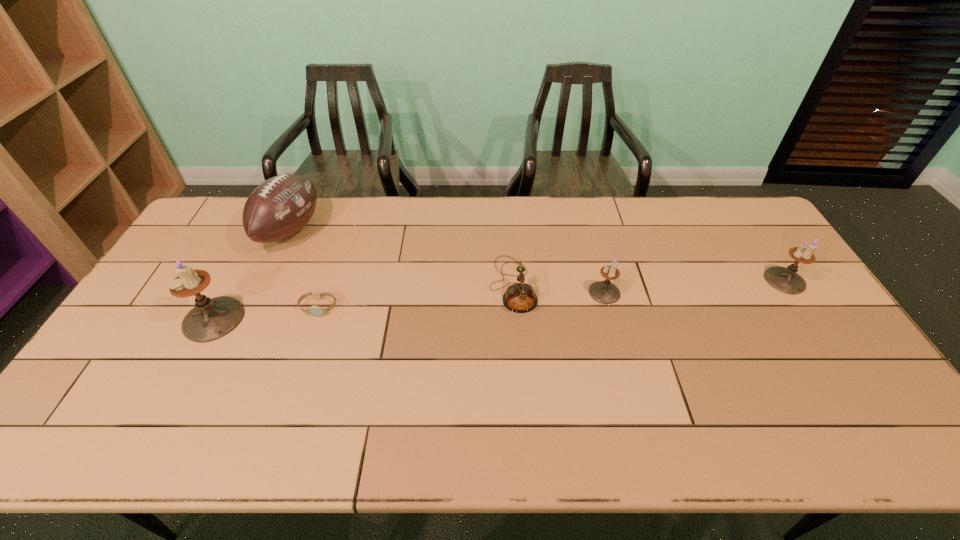
You are a GUI agent. You are given a task and a screenshot of the screen. Output one action in this format:
    pyautogui.click(x=<x>, y=<y>)
    Task: Click on the free space that satisfies the following two spatial constraints: 1. on the rotary dial of the third object from right to left; 2. on the left side of the shortest candle holder
    Image resolution: width=960 pixels, height=540 pixels.
    Given the screenshot: What is the action you would take?
    pyautogui.click(x=514, y=293)